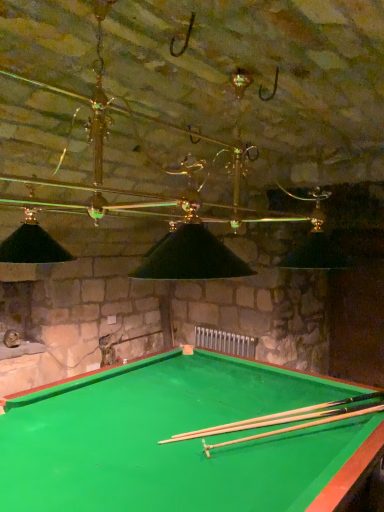
Find the location of a particular element. wooden cue at center is located at coordinates (283, 417).

What do you see at coordinates (283, 417) in the screenshot? Image resolution: width=384 pixels, height=512 pixels. I see `wooden cue at center` at bounding box center [283, 417].

Image resolution: width=384 pixels, height=512 pixels. I want to click on wooden cue at center, so click(x=283, y=417).